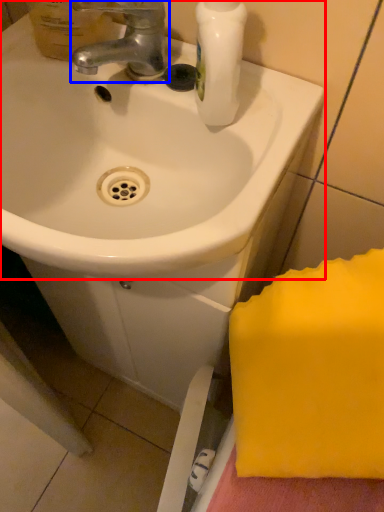
Question: Which object appears farthest to the camera in this image, sink (highlighted by a red box) or tap (highlighted by a blue box)?

Choices:
 (A) sink
 (B) tap

Answer: (B)